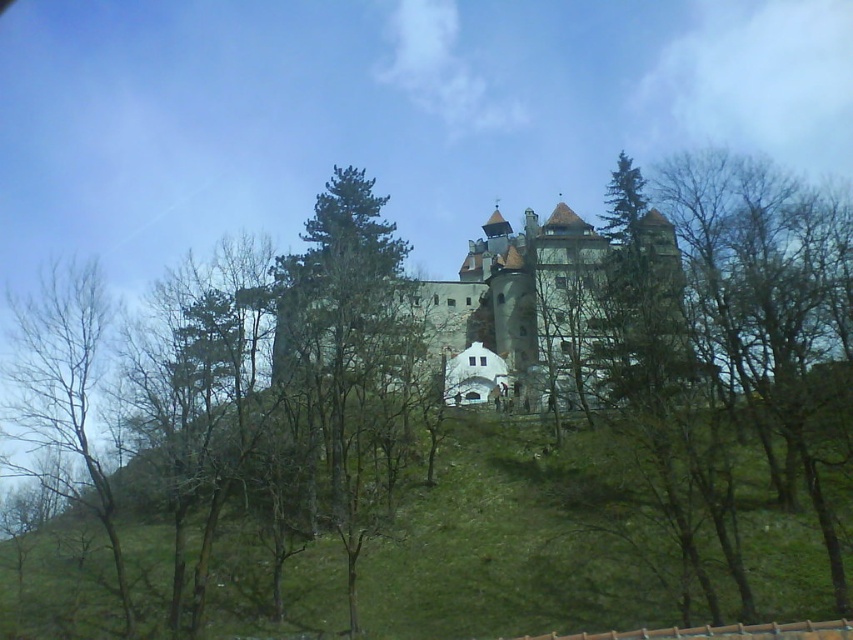
Measure the distance from brown stone castle at center to bare branches at left.

brown stone castle at center and bare branches at left are 47.83 meters apart.

From the picture: Is brown stone castle at center bigger than bare branches at left?

Yes.

Does point (500, 243) lie behind point (13, 342)?

That is True.

This screenshot has height=640, width=853. I want to click on brown stone castle at center, so click(524, 310).